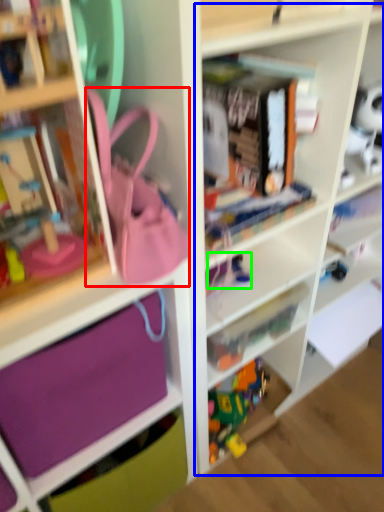
Question: Based on their relative distances, which object is nearer to accessory (highlighted by a red box)? Choose from cabinet (highlighted by a blue box) and toy (highlighted by a green box).

Choices:
 (A) cabinet
 (B) toy

Answer: (B)